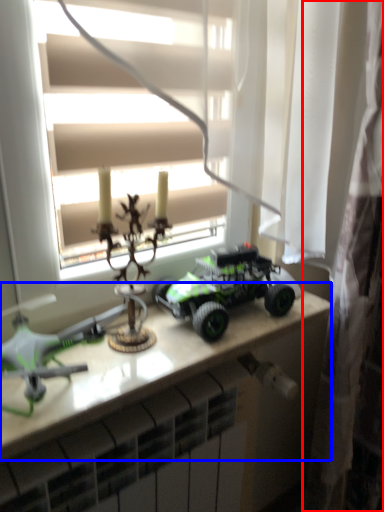
Question: Which of the following is the farthest to the observer, curtain (highlighted by a red box) or table (highlighted by a blue box)?

Choices:
 (A) curtain
 (B) table

Answer: (A)